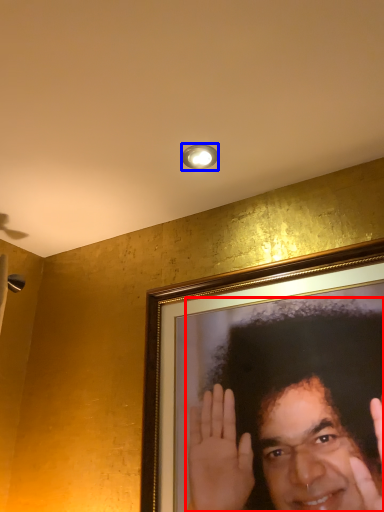
Question: Among these objects, which one is farthest to the camera, man (highlighted by a red box) or light fixture (highlighted by a blue box)?

Choices:
 (A) man
 (B) light fixture

Answer: (B)